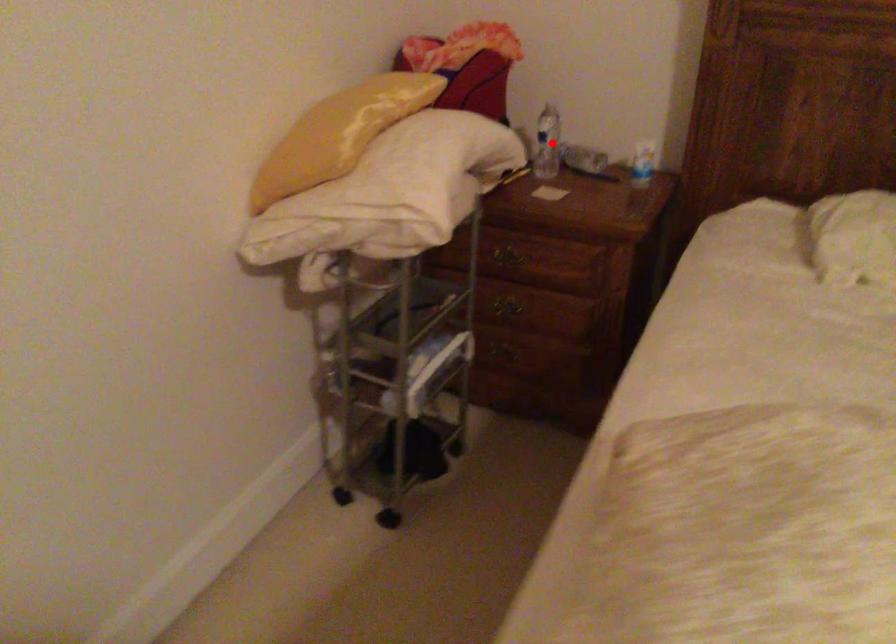
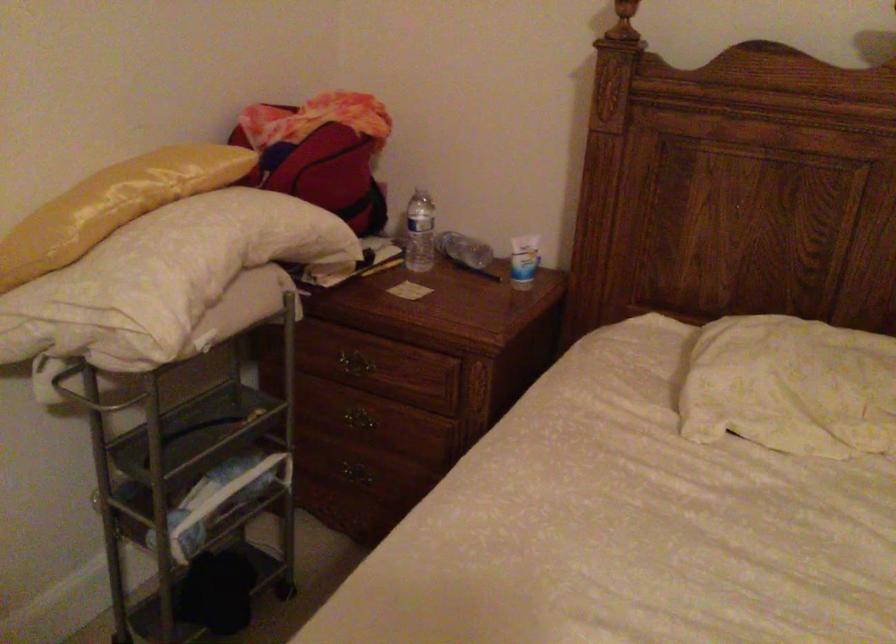
In the second image, find the point that corresponds to the highlighted location in the first image.

(419, 232)